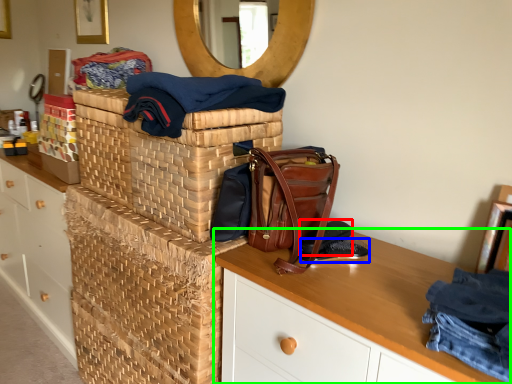
Question: Based on their relative distances, which object is nearer to shoe (highlighted by a red box)? Choose from shoe (highlighted by a blue box) and desk (highlighted by a green box).

Choices:
 (A) shoe
 (B) desk

Answer: (A)